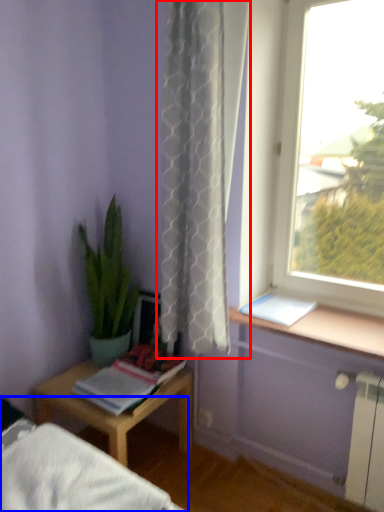
Question: Which of the following is the closest to the observer, curtain (highlighted by a red box) or bed frame (highlighted by a blue box)?

Choices:
 (A) curtain
 (B) bed frame

Answer: (B)